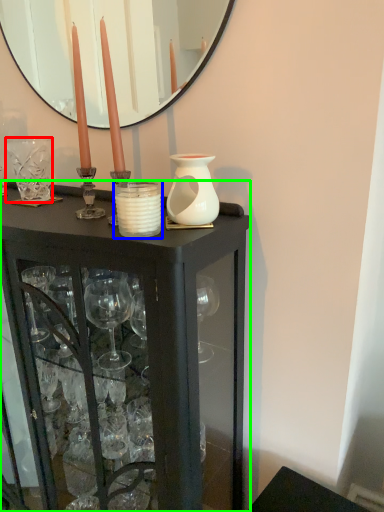
Question: Which object is positioned farthest from glass vase (highlighted by a red box)? Select from candle holder (highlighted by a blue box) and table (highlighted by a green box).

Choices:
 (A) candle holder
 (B) table

Answer: (B)